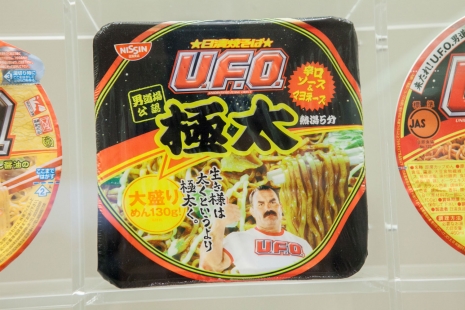
Find the location of a particular element. This screenshot has height=310, width=465. tan tile is located at coordinates (391, 56).